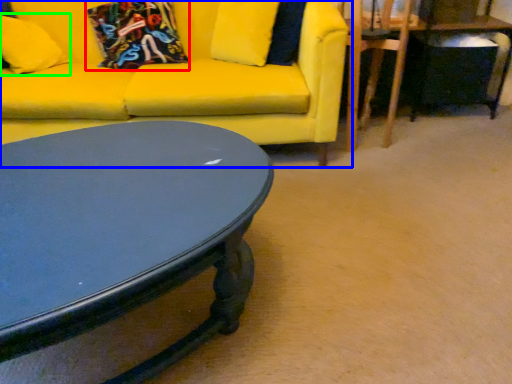
Question: Which object is positioned closest to pillow (highlighted by a red box)? Select from studio couch (highlighted by a blue box) and pillow (highlighted by a green box).

Choices:
 (A) studio couch
 (B) pillow

Answer: (A)